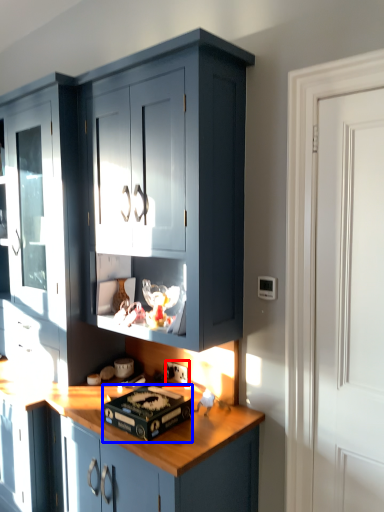
Question: Which object is closer to the camera taking this photo, electric outlet (highlighted by a red box) or appliance (highlighted by a blue box)?

Choices:
 (A) electric outlet
 (B) appliance

Answer: (B)